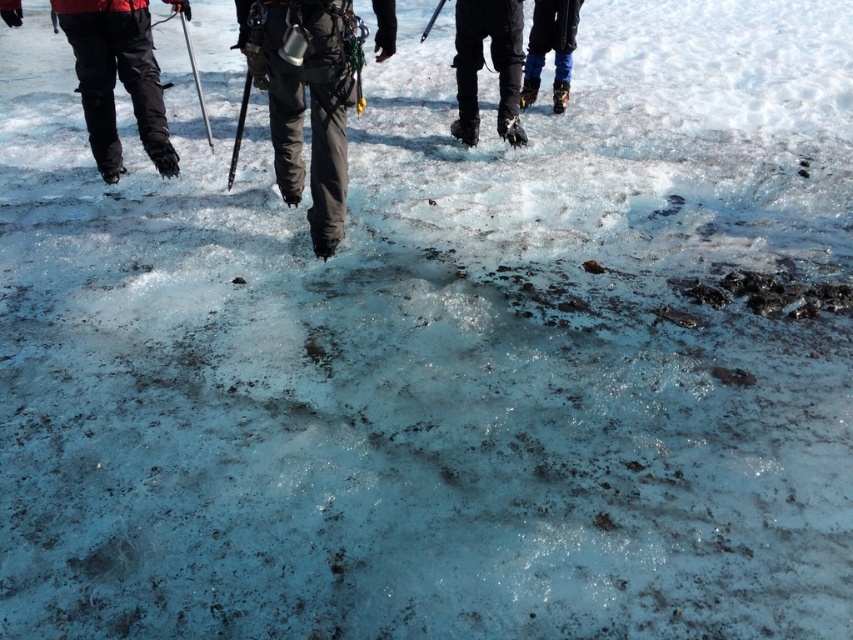
Is black nylon pants at center below blue fabric pants at upper right?

Yes.

Is point (247, 16) less distant than point (532, 20)?

Yes, point (247, 16) is in front of point (532, 20).

Identify the location of black nylon pants at center. (303, 99).

Is black rubber boots at upper center closer to camera compared to blue fabric pants at upper right?

Yes, black rubber boots at upper center is closer to the viewer.

Who is more forward, (469, 81) or (566, 29)?

Point (469, 81) is in front.

Identify the location of black rubber boots at upper center. This screenshot has width=853, height=640. (492, 64).

Does black rubber boots at upper center have a smaller size compared to metallic silver ski pole at center-left?

Yes.

Is the position of black rubber boots at upper center more distant than that of metallic silver ski pole at center-left?

Yes, it is behind metallic silver ski pole at center-left.

Who is more forward, (467, 125) or (196, 84)?

Point (196, 84)

This screenshot has height=640, width=853. Identify the location of black rubber boots at upper center. (492, 64).